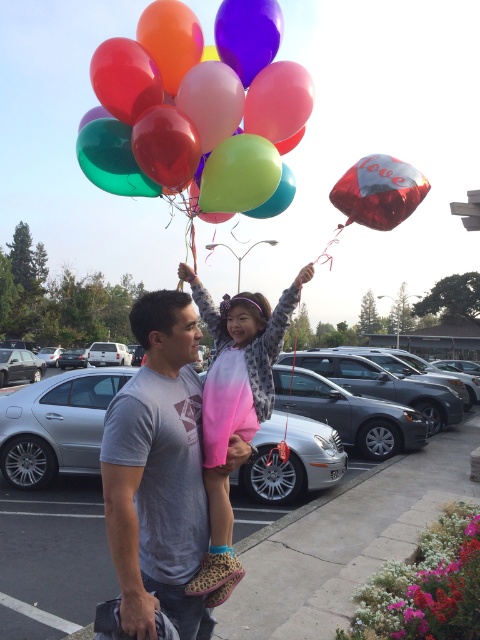
You are a photographer trying to capture the balloons and the sweater in the scene. Since the glossy latex balloons at upper center and the pink ombre sweater at center are both in view, which one should you focus on to ensure they both fit in the frame?

The glossy latex balloons at upper center occupies less space than the pink ombre sweater at center, so you should focus on the pink ombre sweater at center to ensure both fit in the frame.

You are standing in the parking lot and want to take a photo of the point at coordinates [264,173]. The camera you are using has a focal length of 50mm and a sensor size of 24mm x 36mm. If the point is 4.10 meters away from the camera, what is the approximate angle of view required to capture the point in the center of the photo?

The point at coordinates [264,173] is 4.10 meters from the camera. To calculate the angle of view, use the formula angle of view in radians equals arctangent of sensor dimension divided by two divided by focal length divided by two. However, since the point is at the center, the angle of view required would be minimal, just enough to frame the point within the sensor dimensions. The exact calculation would depend on the sensor size and focal length, but given the distance of 4.10 meters, the angle needed